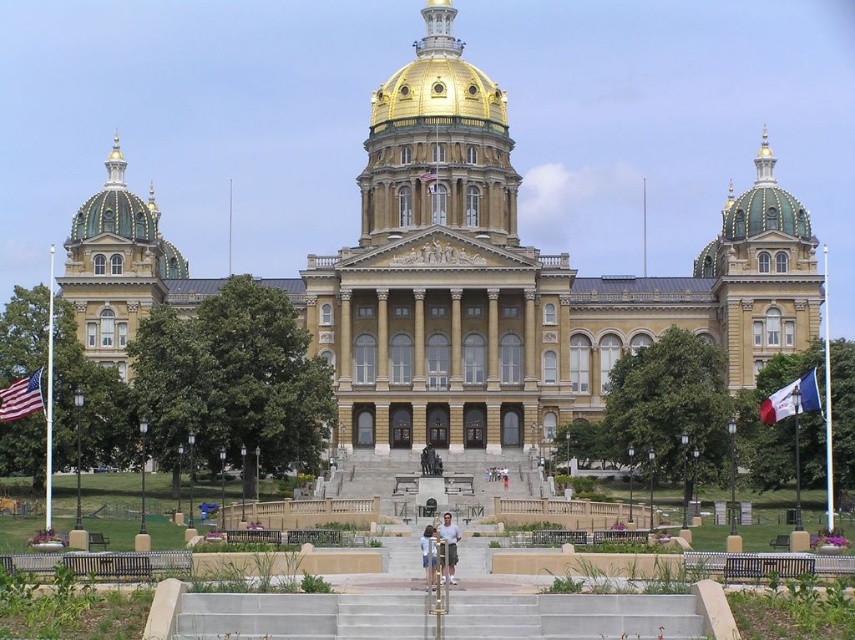
From the picture: Between gray concrete stairs at center and gold/gilded dome at upper right, which one appears on the left side from the viewer's perspective?

From the viewer's perspective, gray concrete stairs at center appears more on the left side.

This screenshot has height=640, width=855. Find the location of `gray concrete stairs at center`. gray concrete stairs at center is located at coordinates (302, 616).

What do you see at coordinates (302, 616) in the screenshot?
I see `gray concrete stairs at center` at bounding box center [302, 616].

You are a GUI agent. You are given a task and a screenshot of the screen. Output one action in this format:
    pyautogui.click(x=<x>, y=<y>)
    Task: Click on the gray concrete stairs at center
    The image size is (855, 640).
    Given the screenshot: What is the action you would take?
    pyautogui.click(x=302, y=616)

Is gold polished dome at center to the left of gold/gilded dome at upper left from the viewer's perspective?

Incorrect, gold polished dome at center is not on the left side of gold/gilded dome at upper left.

Does point (447, 44) come closer to viewer compared to point (131, 205)?

No, it is behind (131, 205).

This screenshot has height=640, width=855. Find the location of `gold polished dome at center`. gold polished dome at center is located at coordinates (438, 83).

Is gray concrete stairs at center smaller than gold/gilded dome at upper left?

Correct, gray concrete stairs at center occupies less space than gold/gilded dome at upper left.

Does gray concrete stairs at center appear on the right side of gold/gilded dome at upper left?

Correct, you'll find gray concrete stairs at center to the right of gold/gilded dome at upper left.

Which is in front, point (187, 612) or point (86, 232)?

Positioned in front is point (187, 612).

I want to click on gray concrete stairs at center, so point(302,616).